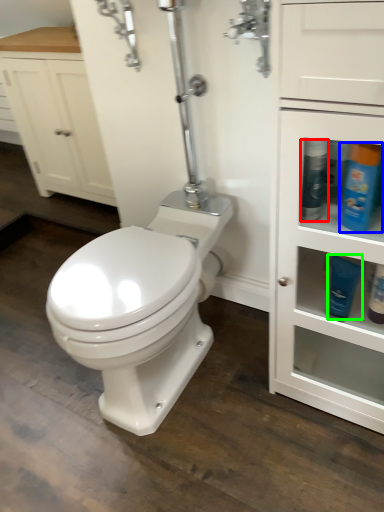
Question: Based on their relative distances, which object is farther from cleaning product (highlighted by a red box)? Choose from cleaning product (highlighted by a blue box) and toiletry (highlighted by a green box).

Choices:
 (A) cleaning product
 (B) toiletry

Answer: (B)